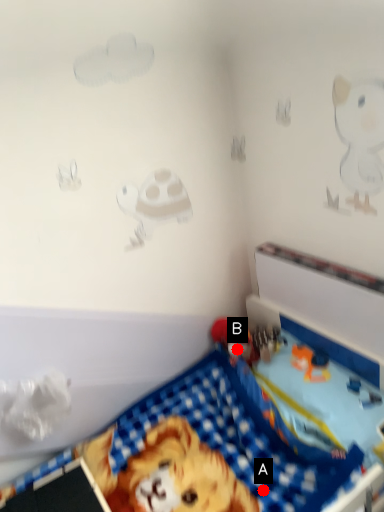
Question: Two points are circled on the image, labeled by A and B beside each circle. Which point is farther from the camera taking this photo?

Choices:
 (A) A is further
 (B) B is further

Answer: (B)